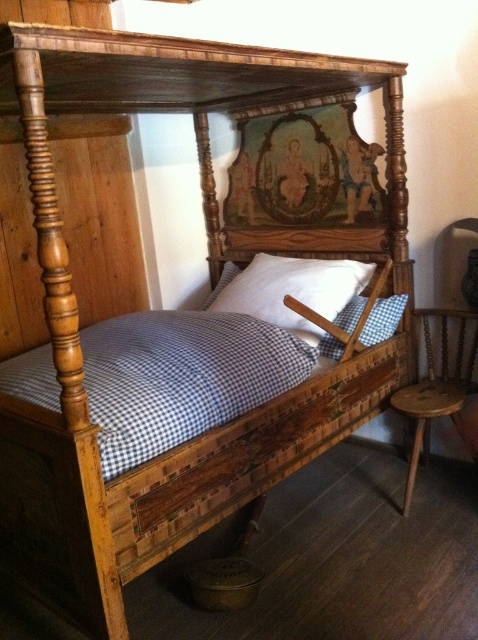
Question: Which of the following is the closest to the observer?

Choices:
 (A) (375, 316)
 (B) (358, 291)

Answer: (A)

Question: Can you confirm if brown wooden chair at right is bigger than white checkered pillow at center?

Choices:
 (A) no
 (B) yes

Answer: (B)

Question: Among these points, which one is nearest to the camera?

Choices:
 (A) (460, 352)
 (B) (381, 339)
 (C) (371, 268)

Answer: (B)

Question: Can you confirm if brown wooden chair at right is positioned to the right of white checkered pillow at center?

Choices:
 (A) no
 (B) yes

Answer: (B)

Question: Is white matte pillow at center to the right of white checkered pillow at center from the viewer's perspective?

Choices:
 (A) yes
 (B) no

Answer: (B)

Question: Which is nearer to the white checkered pillow at center?

Choices:
 (A) brown wooden chair at right
 (B) white matte pillow at center

Answer: (B)